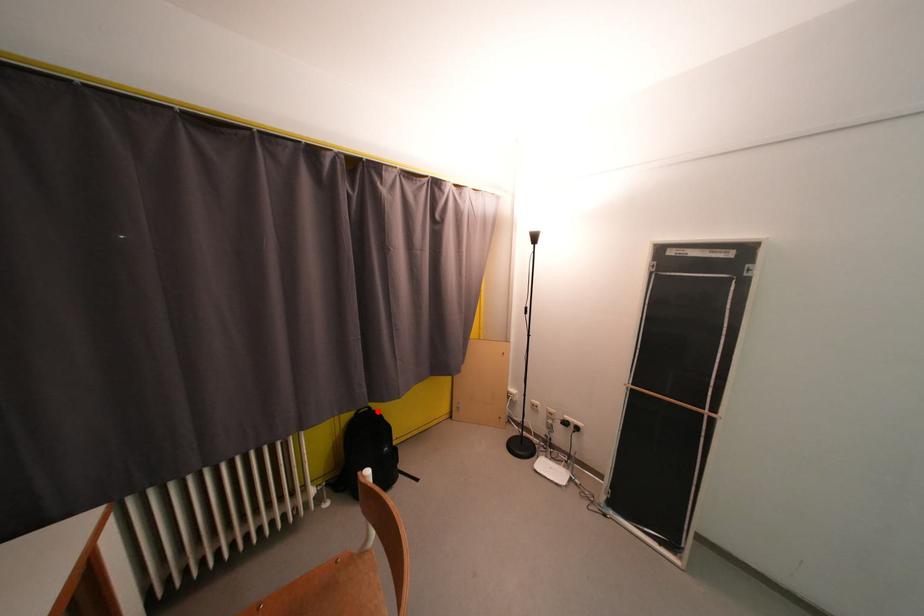
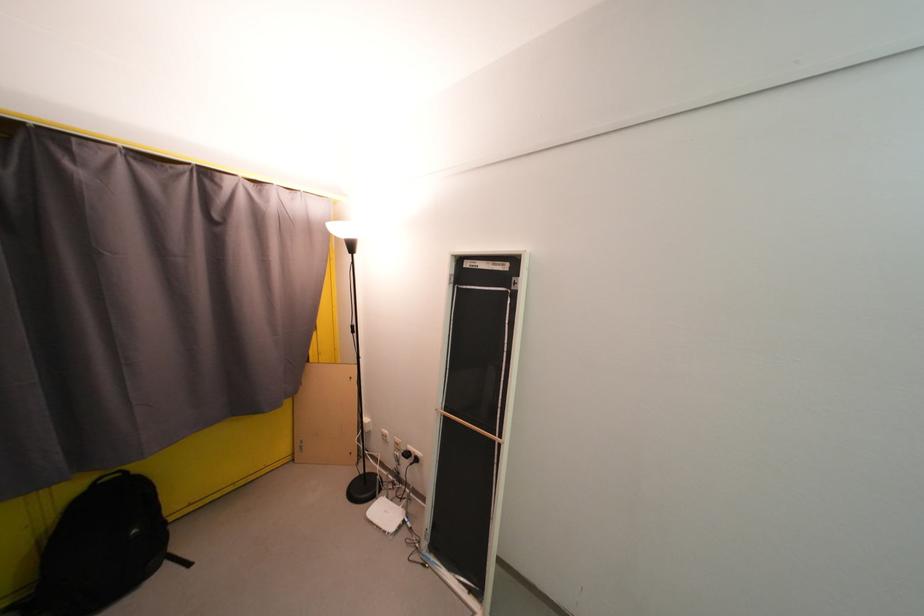
The point at the highlighted location is marked in the first image. Where is the corresponding point in the second image?

(134, 476)